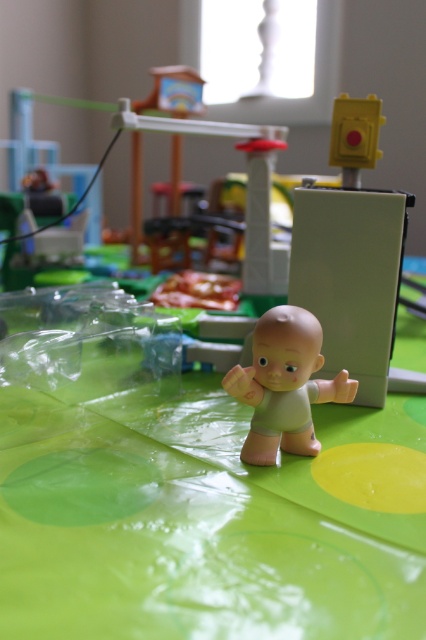
You are a parent trying to place a pacifier on the green plastic table at center so that the smooth beige baby at center can reach it. The pacifier is 1 inch in diameter. Can the baby reach the pacifier if you place it exactly at the edge of the table closest to the baby?

The green plastic table at center and smooth beige baby at center are 6.67 inches apart. If the pacifier is placed at the edge of the table closest to the baby, the distance between the baby and the pacifier would be 6.67 inches minus the table length. However, without knowing the table length, we cannot determine if the baby can reach it. Please provide the table dimensions.

You are setting up a play area for a child and have a green plastic table at center and a smooth beige baby at center. Which object has a greater width?

The green plastic table at center has a greater width than the smooth beige baby at center according to the description.

You are holding a toy airplane that has a wingspan of 15 inches. You want to place it on the green plastic table at center so that it can be seen clearly by someone standing directly in front of the table. Is the table far enough away from you to accommodate the airplane without it being too close to the edge?

The green plastic table at center is 17.12 inches away from the viewer. Since the toy airplane has a wingspan of 15 inches, placing it centrally on the table would leave approximately 1.12 inches of space on each side, which is sufficient to prevent it from being too close to the edge.